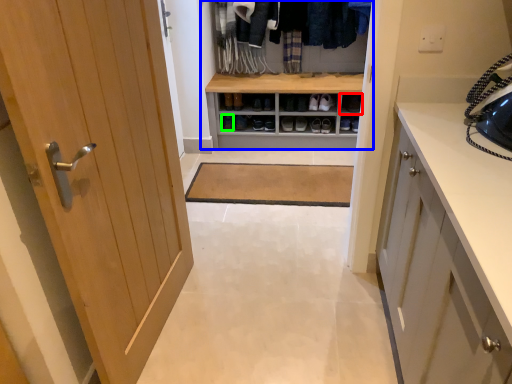
Question: Which object is the closest to the shelf (highlighted by a red box)? Choose among these: dresser (highlighted by a blue box) or shoe (highlighted by a green box).

Choices:
 (A) dresser
 (B) shoe

Answer: (A)